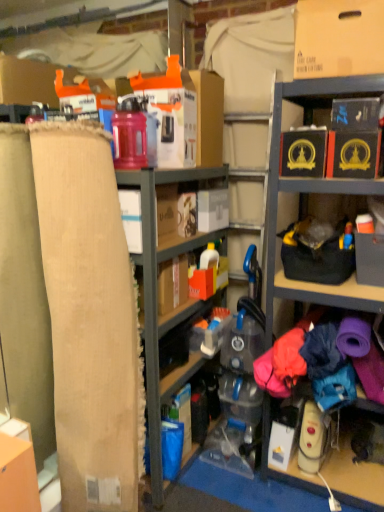
The width and height of the screenshot is (384, 512). What do you see at coordinates (303, 153) in the screenshot?
I see `black cardboard box at upper right, positioned as the 2th storage box in right-to-left order` at bounding box center [303, 153].

The image size is (384, 512). I want to click on black cardboard box at upper right, the 3th storage box in the left-to-right sequence, so click(353, 154).

The height and width of the screenshot is (512, 384). I want to click on beige fabric at left, so click(157, 296).

Locate an element on the screen. The image size is (384, 512). burlap cardboard at left is located at coordinates (90, 318).

What do you see at coordinates (338, 38) in the screenshot?
I see `matte cardboard box at upper right` at bounding box center [338, 38].

Image resolution: width=384 pixels, height=512 pixels. In order to click on white cardboard toaster at center, the first storage box viewed from the left in this screenshot , I will do `click(212, 210)`.

Is matte cardboard box at upper right positioned with its back to black cardboard box at upper right, the 3th storage box in the left-to-right sequence?

matte cardboard box at upper right does not have its back to black cardboard box at upper right, the 3th storage box in the left-to-right sequence.

You are a GUI agent. You are given a task and a screenshot of the screen. Output one action in this format:
    pyautogui.click(x=<x>, y=<y>)
    Task: Click on the cardboard box above the black cardboard box at upper right, acting as the 1th storage box starting from the right (from a real-world perspective)
    
    Given the screenshot: What is the action you would take?
    (338, 38)

Considering the sizes of objects matte cardboard box at upper right and black cardboard box at upper right, acting as the 1th storage box starting from the right, in the image provided, who is wider, matte cardboard box at upper right or black cardboard box at upper right, acting as the 1th storage box starting from the right,?

With larger width is black cardboard box at upper right, acting as the 1th storage box starting from the right.

Who is more distant, matte cardboard box at upper right or black cardboard box at upper right, acting as the 1th storage box starting from the right?

black cardboard box at upper right, acting as the 1th storage box starting from the right, is behind.

Is burlap cardboard at left in front of or behind matte cardboard box at upper right in the image?

Visually, burlap cardboard at left is located in front of matte cardboard box at upper right.

Is burlap cardboard at left not near matte cardboard box at upper right?

That's right, there is a large distance between burlap cardboard at left and matte cardboard box at upper right.

Is matte cardboard box at upper right inside burlap cardboard at left?

No, matte cardboard box at upper right is not a part of burlap cardboard at left.

From a real-world perspective, which object stands above the other?

In real-world perspective, matte cardboard box at upper right is above.

Which is in front, black cardboard box at upper right, positioned as the 2th storage box in right-to-left order, or matte cardboard box at upper right?

matte cardboard box at upper right is closer to the camera.

Based on the photo, is black cardboard box at upper right, which is the 2th storage box from left to right, oriented towards matte cardboard box at upper right?

No, black cardboard box at upper right, which is the 2th storage box from left to right, is not facing towards matte cardboard box at upper right.

Looking at their sizes, would you say black cardboard box at upper right, which is the 2th storage box from left to right, is wider or thinner than matte cardboard box at upper right?

Clearly, black cardboard box at upper right, which is the 2th storage box from left to right, has more width compared to matte cardboard box at upper right.

Considering the positions of point (153, 413) and point (332, 174), is point (153, 413) closer or farther from the camera than point (332, 174)?

Point (153, 413) appears to be farther away from the viewer than point (332, 174).

What are the coordinates of `shelf beneath the black cardboard box at upper right, the 3th storage box in the left-to-right sequence (from a real-world perspective)` in the screenshot? It's located at point(157,296).

Is beige fabric at left located outside black cardboard box at upper right, acting as the 1th storage box starting from the right?

Yes, beige fabric at left is located beyond the bounds of black cardboard box at upper right, acting as the 1th storage box starting from the right.

Can you confirm if white cardboard toaster at center, placed as the third storage box when sorted from right to left, is bigger than burlap cardboard at left?

Actually, white cardboard toaster at center, placed as the third storage box when sorted from right to left, might be smaller than burlap cardboard at left.

Which storage box is the 1st one when counting from the right side of the burlap cardboard at left? Please provide its 2D coordinates.

[(212, 210)]

Visually, is white cardboard toaster at center, the first storage box viewed from the left, positioned to the left or to the right of burlap cardboard at left?

In the image, white cardboard toaster at center, the first storage box viewed from the left, appears on the right side of burlap cardboard at left.

Is white cardboard toaster at center, the first storage box viewed from the left, oriented towards matte cardboard box at upper right?

No.

Who is smaller, white cardboard toaster at center, placed as the third storage box when sorted from right to left, or matte cardboard box at upper right?

white cardboard toaster at center, placed as the third storage box when sorted from right to left, is smaller.

Can you tell me how much white cardboard toaster at center, placed as the third storage box when sorted from right to left, and matte cardboard box at upper right differ in facing direction?

There is a 91.3-degree angle between the facing directions of white cardboard toaster at center, placed as the third storage box when sorted from right to left, and matte cardboard box at upper right.

Which of these two, white cardboard toaster at center, placed as the third storage box when sorted from right to left, or matte cardboard box at upper right, stands shorter?

white cardboard toaster at center, placed as the third storage box when sorted from right to left.

Is black cardboard box at upper right, acting as the 1th storage box starting from the right, surrounding matte cardboard box at upper right?

No, matte cardboard box at upper right is located outside of black cardboard box at upper right, acting as the 1th storage box starting from the right.

In the scene shown: How distant is black cardboard box at upper right, the 3th storage box in the left-to-right sequence, from matte cardboard box at upper right?

The distance of black cardboard box at upper right, the 3th storage box in the left-to-right sequence, from matte cardboard box at upper right is 12.20 inches.

From a real-world perspective, is black cardboard box at upper right, acting as the 1th storage box starting from the right, physically above matte cardboard box at upper right?

Actually, black cardboard box at upper right, acting as the 1th storage box starting from the right, is physically below matte cardboard box at upper right in the real world.

This screenshot has width=384, height=512. I want to click on cardboard box positioned vertically above the black cardboard box at upper right, acting as the 1th storage box starting from the right (from a real-world perspective), so click(x=338, y=38).

Where is `cardboard box that appears on the right of burlap cardboard at left`? cardboard box that appears on the right of burlap cardboard at left is located at coordinates click(x=338, y=38).

When comparing their distances from beige fabric at left, does black cardboard box at upper right, positioned as the 2th storage box in right-to-left order, or burlap cardboard at left seem closer?

The object closer to beige fabric at left is burlap cardboard at left.

Based on their spatial positions, is white cardboard toaster at center, placed as the third storage box when sorted from right to left, or black cardboard box at upper right, the 3th storage box in the left-to-right sequence, closer to burlap cardboard at left?

white cardboard toaster at center, placed as the third storage box when sorted from right to left, is positioned closer to the anchor burlap cardboard at left.

Looking at this image, from the image, which object appears to be nearer to burlap cardboard at left, beige fabric at left or white cardboard toaster at center, the first storage box viewed from the left?

beige fabric at left lies closer to burlap cardboard at left than the other object.

From the image, which object appears to be nearer to matte cardboard box at upper right, black cardboard box at upper right, acting as the 1th storage box starting from the right, or black cardboard box at upper right, positioned as the 2th storage box in right-to-left order?

Based on the image, black cardboard box at upper right, positioned as the 2th storage box in right-to-left order, appears to be nearer to matte cardboard box at upper right.

When comparing their distances from beige fabric at left, does black cardboard box at upper right, which is the 2th storage box from left to right, or white cardboard toaster at center, placed as the third storage box when sorted from right to left, seem further?

black cardboard box at upper right, which is the 2th storage box from left to right, lies further to beige fabric at left than the other object.

Based on their spatial positions, is burlap cardboard at left or matte cardboard box at upper right further from white cardboard toaster at center, placed as the third storage box when sorted from right to left?

matte cardboard box at upper right is positioned further to the anchor white cardboard toaster at center, placed as the third storage box when sorted from right to left.

Looking at the image, which one is located closer to white cardboard toaster at center, the first storage box viewed from the left, black cardboard box at upper right, positioned as the 2th storage box in right-to-left order, or black cardboard box at upper right, the 3th storage box in the left-to-right sequence?

Based on the image, black cardboard box at upper right, positioned as the 2th storage box in right-to-left order, appears to be nearer to white cardboard toaster at center, the first storage box viewed from the left.

Based on their spatial positions, is matte cardboard box at upper right or white cardboard toaster at center, the first storage box viewed from the left, closer to burlap cardboard at left?

white cardboard toaster at center, the first storage box viewed from the left, lies closer to burlap cardboard at left than the other object.

Locate an element on the screen. The height and width of the screenshot is (512, 384). shelf between burlap cardboard at left and white cardboard toaster at center, the first storage box viewed from the left, along the z-axis is located at coordinates (157, 296).

At what (x,y) coordinates should I click in order to perform the action: click on storage box between matte cardboard box at upper right and black cardboard box at upper right, the 3th storage box in the left-to-right sequence, from top to bottom. Please return your answer as a coordinate pair (x, y). This screenshot has width=384, height=512. Looking at the image, I should click on (303, 153).

This screenshot has width=384, height=512. What are the coordinates of `shelf between burlap cardboard at left and black cardboard box at upper right, positioned as the 2th storage box in right-to-left order` in the screenshot? It's located at (157, 296).

The height and width of the screenshot is (512, 384). In order to click on shelf between matte cardboard box at upper right and burlap cardboard at left in the vertical direction in this screenshot , I will do `click(157, 296)`.